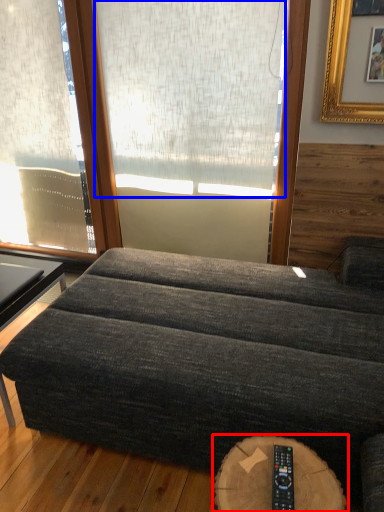
Question: Which object appears farthest to the camera in this image, round table (highlighted by a red box) or window screen (highlighted by a blue box)?

Choices:
 (A) round table
 (B) window screen

Answer: (B)